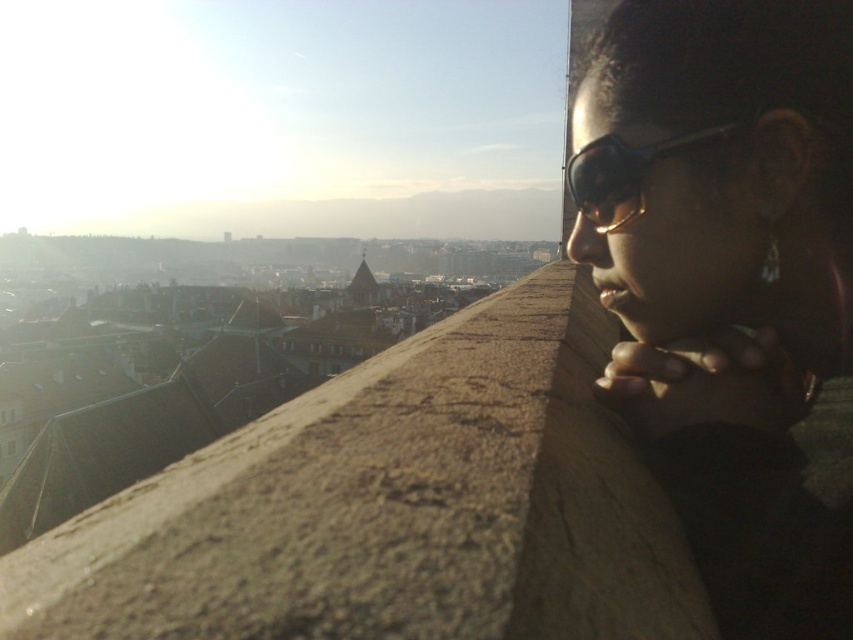
Who is shorter, matte black sunglasses at upper right or black matte goggles at upper right?

Standing shorter between the two is black matte goggles at upper right.

Who is more distant from viewer, (755, 541) or (579, 157)?

Point (579, 157)

Is point (726, 547) farther from viewer compared to point (602, 180)?

No.

Find the location of `matte black sunglasses at upper right`. matte black sunglasses at upper right is located at coordinates (730, 285).